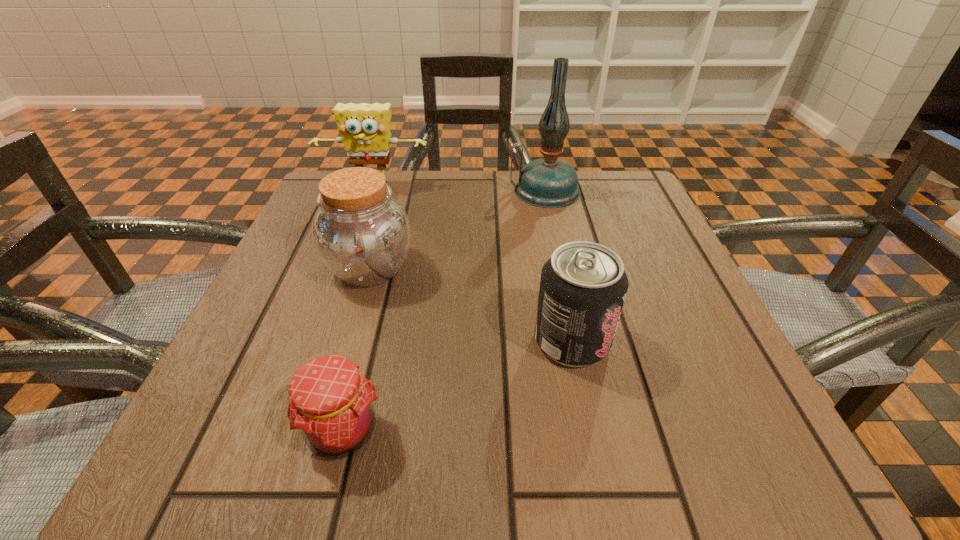
The image size is (960, 540). I want to click on object located at the far right corner, so click(x=548, y=182).

Where is `blank space at the far edge of the desktop`? This screenshot has width=960, height=540. blank space at the far edge of the desktop is located at coordinates (486, 195).

Identify the location of free point at the near edge. The width and height of the screenshot is (960, 540). (556, 467).

The width and height of the screenshot is (960, 540). I want to click on vacant area at the left edge, so click(x=212, y=401).

Locate an element on the screen. The width and height of the screenshot is (960, 540). free region at the right edge is located at coordinates (687, 269).

Where is `free region at the far right corner of the desktop`? The height and width of the screenshot is (540, 960). free region at the far right corner of the desktop is located at coordinates (589, 215).

This screenshot has height=540, width=960. Identify the location of vacant region at the near right corner. (701, 447).

I want to click on vacant area between the fourth farthest object and the jar, so click(x=470, y=305).

The image size is (960, 540). I want to click on vacant space that's between the shortest object and the oil lamp, so click(x=444, y=310).

Where is `free space between the shortest object and the sponge`? The image size is (960, 540). free space between the shortest object and the sponge is located at coordinates (358, 309).